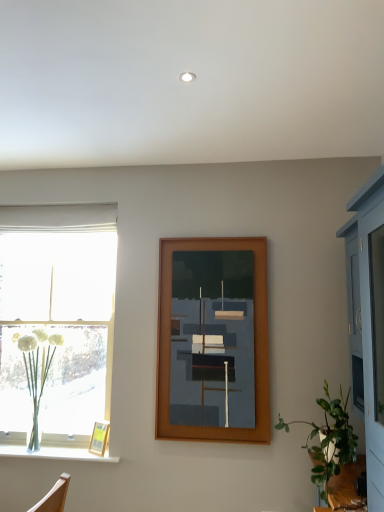
Describe the element at coordinates (328, 440) in the screenshot. I see `green leafy plant at lower right` at that location.

Describe the element at coordinates (213, 340) in the screenshot. The image size is (384, 512). I see `wooden picture frame at center, the second picture frame in the bottom-to-top sequence` at that location.

Where is `white fabric curtain at left`? The image size is (384, 512). white fabric curtain at left is located at coordinates (59, 218).

The image size is (384, 512). Find the location of `clear glass vase at left`. clear glass vase at left is located at coordinates (36, 372).

Where is `picture frame located on the right of wooden picture frame at lower left, placed as the first picture frame when sorted from left to right`? This screenshot has width=384, height=512. picture frame located on the right of wooden picture frame at lower left, placed as the first picture frame when sorted from left to right is located at coordinates (213, 340).

Does wooden picture frame at lower left, placed as the first picture frame when sorted from left to right, have a larger size compared to wooden picture frame at center, placed as the 1th picture frame when sorted from top to bottom?

Actually, wooden picture frame at lower left, placed as the first picture frame when sorted from left to right, might be smaller than wooden picture frame at center, placed as the 1th picture frame when sorted from top to bottom.

From a real-world perspective, is wooden picture frame at lower left, which is the second picture frame from top to bottom, physically located above or below wooden picture frame at center, which appears as the first picture frame when viewed from the right?

From a real-world perspective, wooden picture frame at lower left, which is the second picture frame from top to bottom, is physically below wooden picture frame at center, which appears as the first picture frame when viewed from the right.

From the picture: Could you measure the distance between wooden picture frame at center, the second picture frame in the bottom-to-top sequence, and clear glass vase at left?

They are 4.18 feet apart.

From the image's perspective, is wooden picture frame at center, which appears as the 2th picture frame when viewed from the left, located above clear glass vase at left?

Correct, wooden picture frame at center, which appears as the 2th picture frame when viewed from the left, appears higher than clear glass vase at left in the image.

From a real-world perspective, who is located higher, wooden picture frame at center, which appears as the first picture frame when viewed from the right, or clear glass vase at left?

wooden picture frame at center, which appears as the first picture frame when viewed from the right, from a real-world perspective.

Is wooden picture frame at center, which appears as the first picture frame when viewed from the right, in contact with clear glass vase at left?

No, wooden picture frame at center, which appears as the first picture frame when viewed from the right, is not with clear glass vase at left.

Where is `plant in front of the clear glass vase at lower left`? The image size is (384, 512). plant in front of the clear glass vase at lower left is located at coordinates (36, 372).

Is clear glass vase at lower left looking in the opposite direction of clear glass vase at left?

No, clear glass vase at lower left's orientation is not away from clear glass vase at left.

Which object is closer to the camera taking this photo, clear glass vase at lower left or clear glass vase at left?

clear glass vase at left.

Looking at this image, between clear glass vase at lower left and clear glass vase at left, which one has smaller width?

Thinner between the two is clear glass vase at lower left.

From the image's perspective, would you say clear glass vase at left is shown under white fabric curtain at left?

Yes, from the image's perspective, clear glass vase at left is below white fabric curtain at left.

Is clear glass vase at left in front of or behind white fabric curtain at left in the image?

clear glass vase at left is positioned closer to the viewer than white fabric curtain at left.

Does clear glass vase at left have a smaller size compared to white fabric curtain at left?

Incorrect, clear glass vase at left is not smaller in size than white fabric curtain at left.

This screenshot has height=512, width=384. In the image, there is a green leafy plant at lower right. Find the location of `window sill below it (from a real-world perspective)`. window sill below it (from a real-world perspective) is located at coordinates (56, 453).

Is green leafy plant at lower right oriented towards clear glass vase at lower left?

Yes.

Relative to clear glass vase at lower left, is green leafy plant at lower right in front or behind?

green leafy plant at lower right is in front of clear glass vase at lower left.

From the picture: From a real-world perspective, who is located lower, green leafy plant at lower right or clear glass vase at lower left?

clear glass vase at lower left is physically lower.

In terms of width, does wooden picture frame at lower left, which is the second picture frame from top to bottom, look wider or thinner when compared to green leafy plant at lower right?

wooden picture frame at lower left, which is the second picture frame from top to bottom, is thinner than green leafy plant at lower right.

Considering the sizes of wooden picture frame at lower left, which ranks as the second picture frame in right-to-left order, and green leafy plant at lower right in the image, is wooden picture frame at lower left, which ranks as the second picture frame in right-to-left order, taller or shorter than green leafy plant at lower right?

Clearly, wooden picture frame at lower left, which ranks as the second picture frame in right-to-left order, is shorter compared to green leafy plant at lower right.

Which object is positioned more to the right, wooden picture frame at lower left, positioned as the first picture frame in bottom-to-top order, or green leafy plant at lower right?

From the viewer's perspective, green leafy plant at lower right appears more on the right side.

Which of these two, green leafy plant at lower right or white fabric curtain at left, stands shorter?

white fabric curtain at left.

Is green leafy plant at lower right aimed at white fabric curtain at left?

No, green leafy plant at lower right is not turned towards white fabric curtain at left.

Is point (351, 450) closer to camera compared to point (69, 219)?

Yes, it is in front of point (69, 219).

Image resolution: width=384 pixels, height=512 pixels. In the image, there is a white fabric curtain at left. What are the coordinates of `houseplant below it (from the image's perspective)` in the screenshot? It's located at (328, 440).

You are a GUI agent. You are given a task and a screenshot of the screen. Output one action in this format:
    pyautogui.click(x=<x>, y=<y>)
    Task: Click on the picture frame above the wooden picture frame at lower left, positioned as the first picture frame in bottom-to-top order (from a real-world perspective)
    The image size is (384, 512).
    Given the screenshot: What is the action you would take?
    pyautogui.click(x=213, y=340)

Find the location of a particular element. plant lying on the left of wooden picture frame at center, which appears as the first picture frame when viewed from the right is located at coordinates (36, 372).

Which object lies nearer to the anchor point green leafy plant at lower right, clear glass vase at lower left or white fabric curtain at left?

The object closer to green leafy plant at lower right is clear glass vase at lower left.

From the image, which object appears to be nearer to white fabric curtain at left, clear glass vase at lower left or green leafy plant at lower right?

The object closer to white fabric curtain at left is clear glass vase at lower left.

From the image, which object appears to be nearer to wooden picture frame at lower left, positioned as the first picture frame in bottom-to-top order, clear glass vase at left or clear glass vase at lower left?

clear glass vase at lower left is positioned closer to the anchor wooden picture frame at lower left, positioned as the first picture frame in bottom-to-top order.

When comparing their distances from wooden picture frame at lower left, placed as the first picture frame when sorted from left to right, does clear glass vase at left or wooden picture frame at center, the second picture frame in the bottom-to-top sequence, seem further?

wooden picture frame at center, the second picture frame in the bottom-to-top sequence, is further to wooden picture frame at lower left, placed as the first picture frame when sorted from left to right.

Looking at the image, which one is located further to wooden picture frame at lower left, which ranks as the second picture frame in right-to-left order, clear glass vase at lower left or clear glass vase at left?

Answer: clear glass vase at left.

When comparing their distances from wooden picture frame at center, which appears as the 2th picture frame when viewed from the left, does white fabric curtain at left or clear glass vase at lower left seem further?

white fabric curtain at left.

Looking at the image, which one is located further to clear glass vase at left, wooden picture frame at lower left, positioned as the first picture frame in bottom-to-top order, or wooden picture frame at center, the second picture frame in the bottom-to-top sequence?

wooden picture frame at center, the second picture frame in the bottom-to-top sequence, lies further to clear glass vase at left than the other object.

When comparing their distances from wooden picture frame at center, the second picture frame in the bottom-to-top sequence, does green leafy plant at lower right or wooden picture frame at lower left, which ranks as the second picture frame in right-to-left order, seem closer?

green leafy plant at lower right is positioned closer to the anchor wooden picture frame at center, the second picture frame in the bottom-to-top sequence.

This screenshot has height=512, width=384. I want to click on plant between white fabric curtain at left and wooden picture frame at lower left, which is the second picture frame from top to bottom, in the up-down direction, so click(x=36, y=372).

At what (x,y) coordinates should I click in order to perform the action: click on window sill between white fabric curtain at left and green leafy plant at lower right from left to right. Please return your answer as a coordinate pair (x, y). This screenshot has height=512, width=384. Looking at the image, I should click on (56, 453).

You are a GUI agent. You are given a task and a screenshot of the screen. Output one action in this format:
    pyautogui.click(x=<x>, y=<y>)
    Task: Click on the curtain between clear glass vase at left and green leafy plant at lower right from left to right
    
    Given the screenshot: What is the action you would take?
    pyautogui.click(x=59, y=218)

The height and width of the screenshot is (512, 384). What are the coordinates of `picture frame between wooden picture frame at lower left, which ranks as the second picture frame in right-to-left order, and green leafy plant at lower right` in the screenshot? It's located at (213, 340).